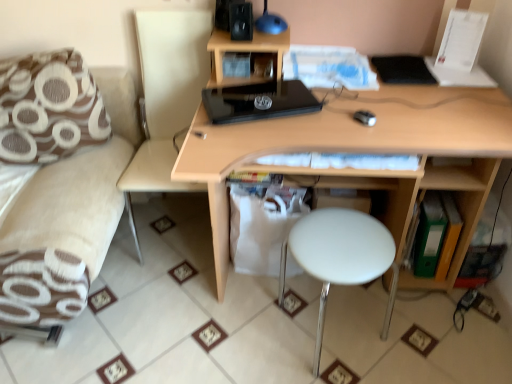
Question: Does brown fabric couch at left come behind black glossy laptop at center?

Choices:
 (A) yes
 (B) no

Answer: (B)

Question: Is brown fabric couch at left closer to the viewer compared to black glossy laptop at center?

Choices:
 (A) no
 (B) yes

Answer: (B)

Question: Is brown fabric couch at left to the left of black glossy laptop at center from the viewer's perspective?

Choices:
 (A) no
 (B) yes

Answer: (B)

Question: From a real-world perspective, is brown fabric couch at left under black glossy laptop at center?

Choices:
 (A) yes
 (B) no

Answer: (A)

Question: Would you say brown fabric couch at left is outside black glossy laptop at center?

Choices:
 (A) no
 (B) yes

Answer: (B)

Question: Is brown fabric couch at left aimed at black glossy laptop at center?

Choices:
 (A) yes
 (B) no

Answer: (B)

Question: Is green plastic folder at lower right surrounding white glossy stool at center?

Choices:
 (A) yes
 (B) no

Answer: (B)

Question: From a real-world perspective, is green plastic folder at lower right positioned under white glossy stool at center based on gravity?

Choices:
 (A) no
 (B) yes

Answer: (B)

Question: Can you confirm if green plastic folder at lower right is taller than white glossy stool at center?

Choices:
 (A) yes
 (B) no

Answer: (B)

Question: Can you confirm if green plastic folder at lower right is positioned to the right of white glossy stool at center?

Choices:
 (A) no
 (B) yes

Answer: (B)

Question: Does green plastic folder at lower right come in front of white glossy stool at center?

Choices:
 (A) yes
 (B) no

Answer: (B)

Question: Does green plastic folder at lower right have a smaller size compared to white glossy stool at center?

Choices:
 (A) yes
 (B) no

Answer: (A)

Question: Is black matte speaker at upper center looking in the opposite direction of light wood desk at center?

Choices:
 (A) no
 (B) yes

Answer: (A)